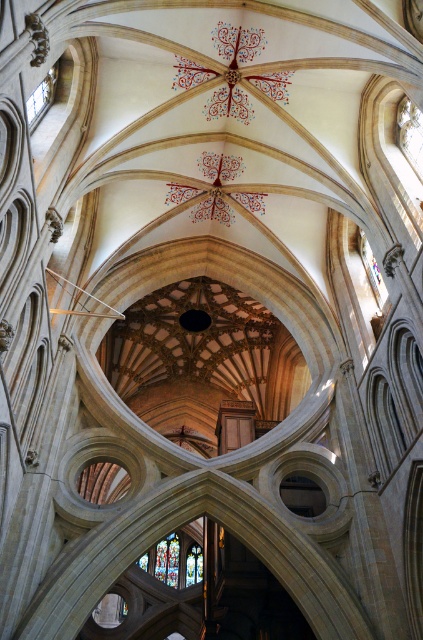
Which is in front, point (170, 554) or point (417, 120)?

Point (417, 120)

Who is higher up, stained glass at lower center or transparent stained glass at upper right?

transparent stained glass at upper right

Measure the distance between point (x=148, y=572) and camera.

A distance of 200.97 meters exists between point (x=148, y=572) and camera.

Locate an element on the screen. This screenshot has height=640, width=423. stained glass at lower center is located at coordinates (175, 561).

Is point (164, 540) more distant than point (27, 124)?

Yes, point (164, 540) is behind point (27, 124).

Does stained glass at lower center lie in front of transparent glass window at upper left?

No, it is not.

Is point (156, 545) positioned before point (46, 106)?

Yes, point (156, 545) is in front of point (46, 106).

Where is `stained glass at lower center`? stained glass at lower center is located at coordinates (175, 561).

Can you confirm if transparent stained glass at upper right is positioned below transparent glass window at upper left?

Yes, transparent stained glass at upper right is below transparent glass window at upper left.

Which is below, transparent stained glass at upper right or transparent glass window at upper left?

transparent stained glass at upper right is lower down.

The height and width of the screenshot is (640, 423). Identify the location of transparent stained glass at upper right. (409, 132).